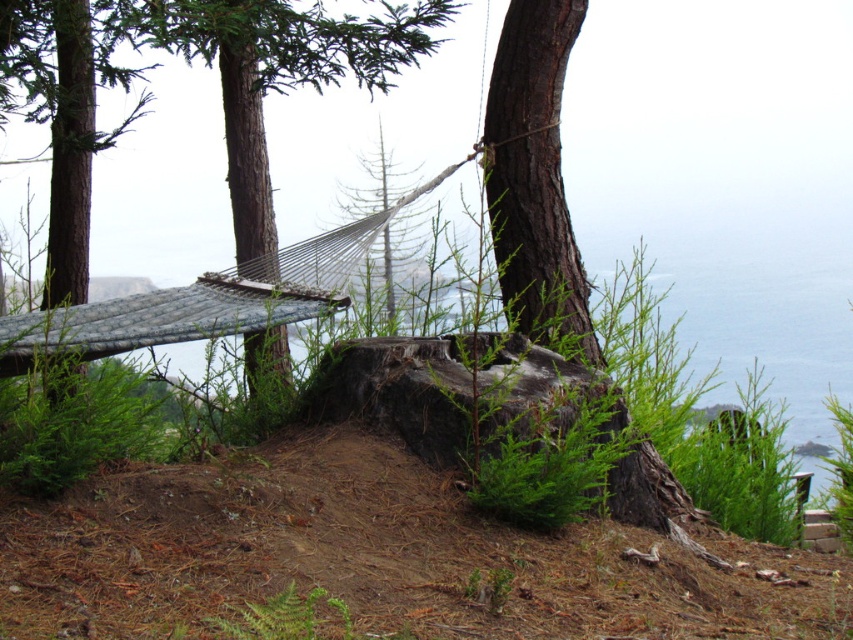
Between green textured hammock at center and brown rough wood at left, which one appears on the right side from the viewer's perspective?

Positioned to the right is green textured hammock at center.

Who is more distant from viewer, [200,40] or [56,140]?

The point [56,140] is behind.

Between point (294, 81) and point (62, 195), which one is positioned behind?

The point (62, 195) is more distant.

Find the location of a particular element. green textured hammock at center is located at coordinates (282, 77).

Is brown rough tree trunk at center positioned in front of brown rough wood at left?

Yes.

Between brown rough tree trunk at center and brown rough wood at left, which one appears on the left side from the viewer's perspective?

brown rough wood at left is more to the left.

I want to click on brown rough tree trunk at center, so click(x=535, y=179).

Is green textured hammock at center wider than brown rough tree trunk at center?

Yes, green textured hammock at center is wider than brown rough tree trunk at center.

Describe the element at coordinates (282, 77) in the screenshot. I see `green textured hammock at center` at that location.

Find the location of `green textured hammock at center`. green textured hammock at center is located at coordinates (282, 77).